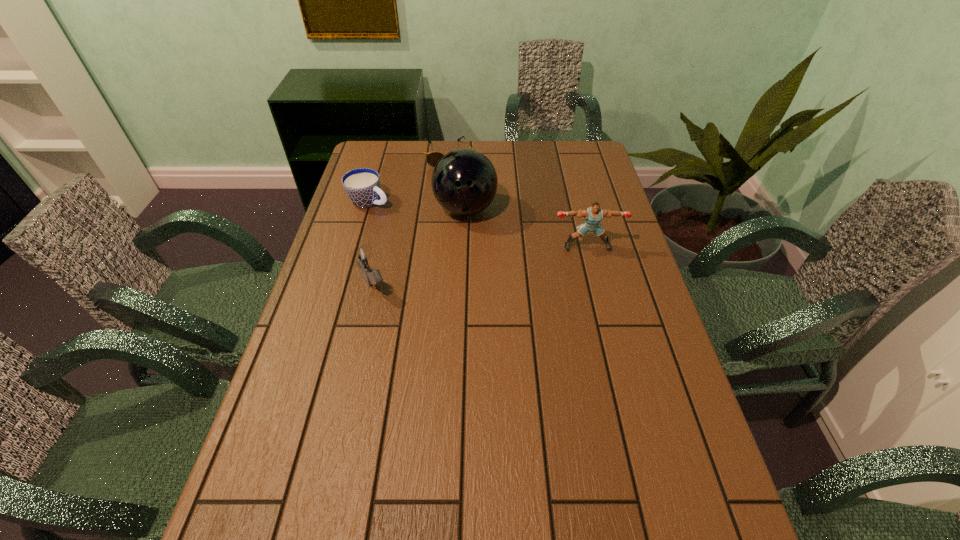
Locate an element on the screen. igniter positioned at the left edge is located at coordinates (359, 256).

Find the location of a particular element. cup positioned at the left edge is located at coordinates (362, 186).

Image resolution: width=960 pixels, height=540 pixels. In order to click on object that is at the right edge in this screenshot , I will do `click(593, 215)`.

You are a GUI agent. You are given a task and a screenshot of the screen. Output one action in this format:
    pyautogui.click(x=<x>, y=<y>)
    Task: Click on the vacant space at the far edge of the desktop
    
    Given the screenshot: What is the action you would take?
    pyautogui.click(x=512, y=156)

Locate an element on the screen. The image size is (960, 540). free region at the near edge of the desktop is located at coordinates (623, 461).

This screenshot has height=540, width=960. Identify the location of vacant space at the left edge. (383, 244).

Identify the location of vacant space at the right edge. This screenshot has width=960, height=540. (631, 373).

This screenshot has height=540, width=960. In order to click on vacant region at the far left corner of the desktop in this screenshot , I will do `click(376, 146)`.

In the image, there is a desktop. At what (x,y) coordinates should I click in order to perform the action: click on vacant space at the far right corner. Please return your answer as a coordinate pair (x, y). Looking at the image, I should click on (572, 141).

Find the location of `vacant space at the near right corner`. vacant space at the near right corner is located at coordinates (664, 506).